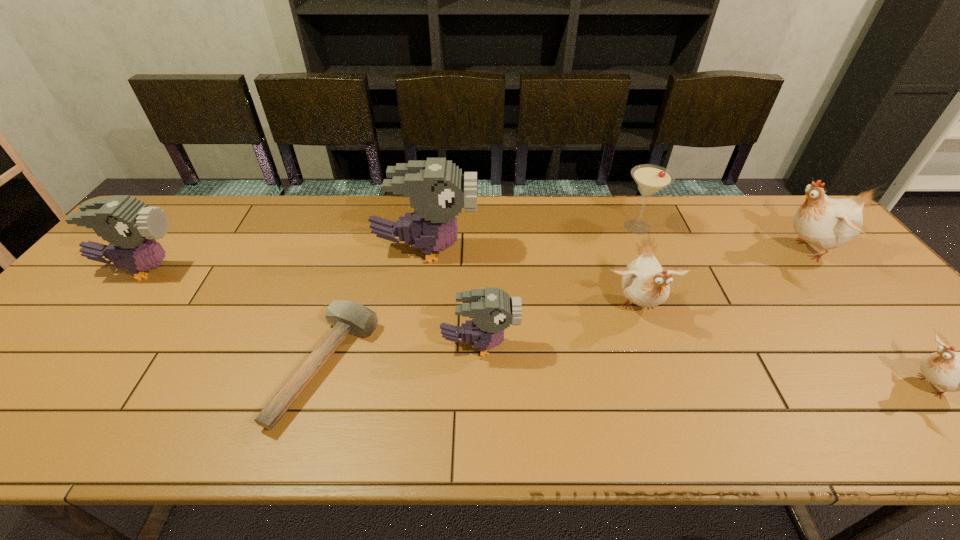
Identify the location of object located at the near edge. (x=347, y=317).

The height and width of the screenshot is (540, 960). I want to click on object present at the left edge, so point(130,226).

Image resolution: width=960 pixels, height=540 pixels. What are the coordinates of `object at the right edge` in the screenshot? It's located at (826, 223).

Locate an element on the screen. Image resolution: width=960 pixels, height=540 pixels. object that is at the far right corner is located at coordinates (826, 223).

Identify the location of vacant space at the far edge of the desktop. The width and height of the screenshot is (960, 540). (313, 230).

Where is `vacant area at the left edge`? This screenshot has height=540, width=960. vacant area at the left edge is located at coordinates (9, 386).

Image resolution: width=960 pixels, height=540 pixels. Identify the location of free location at the right edge. (863, 310).

At what (x,y) coordinates should I click in order to perform the action: click on empty space between the second smallest gray bird and the martini. Please return your answer as a coordinate pair (x, y). The width and height of the screenshot is (960, 540). Looking at the image, I should click on (391, 248).

Locate an element on the screen. The width and height of the screenshot is (960, 540). empty location between the biggest white bird and the biggest gray bird is located at coordinates (616, 250).

Find the location of a particular element. Image resolution: width=960 pixels, height=540 pixels. free spot between the nearest gray bird and the gray mallet is located at coordinates (403, 356).